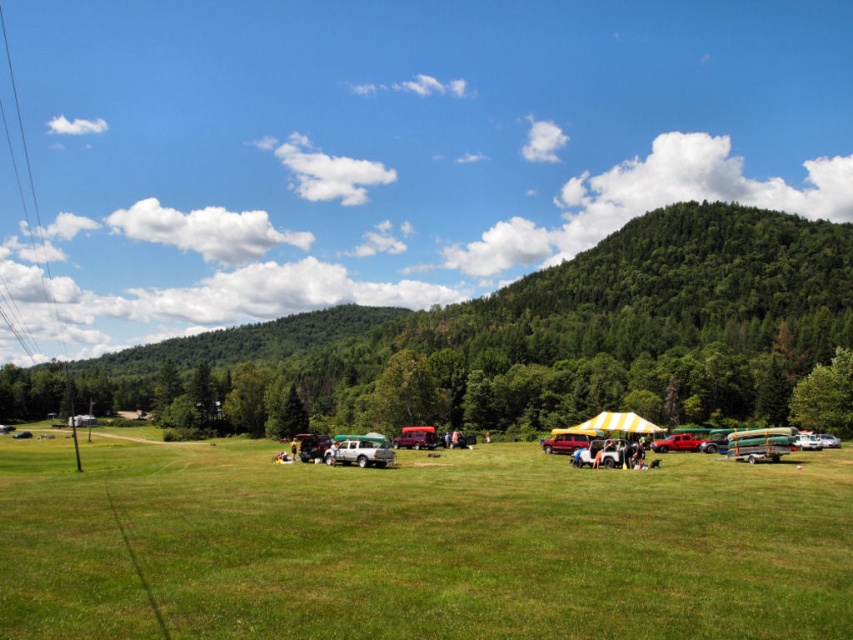
You are planning to set up a large tent for an event. Based on the scene, which area would be more suitable between the green grassy field at center and the green forested hill at center, and why?

The green grassy field at center is more suitable because it has a smaller size compared to the green forested hill at center, making it easier to set up a large tent without needing to clear too much space.

Looking at this image, you are standing at the center of the grassy field and want to walk towards the green forested hill at center. In which direction should you head?

The green forested hill at center is located at point (572, 328), so you should head towards the center of the image to reach it.

You are planning to take a photo of the green forested hill at center and the silver metallic truck at center from a position where both are visible. Which object will appear larger in the photo?

The green forested hill at center will appear larger in the photo because it is taller than the silver metallic truck at center.